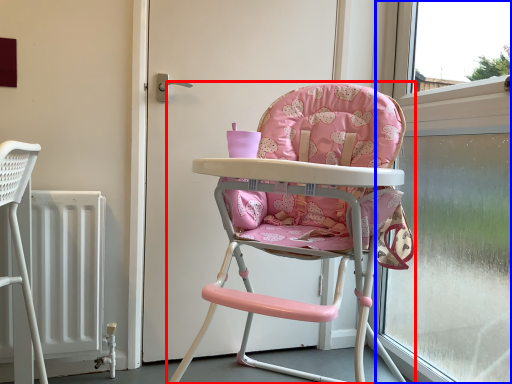
Question: Which object appears closest to the camera in this image, chair (highlighted by a red box) or window frame (highlighted by a blue box)?

Choices:
 (A) chair
 (B) window frame

Answer: (A)